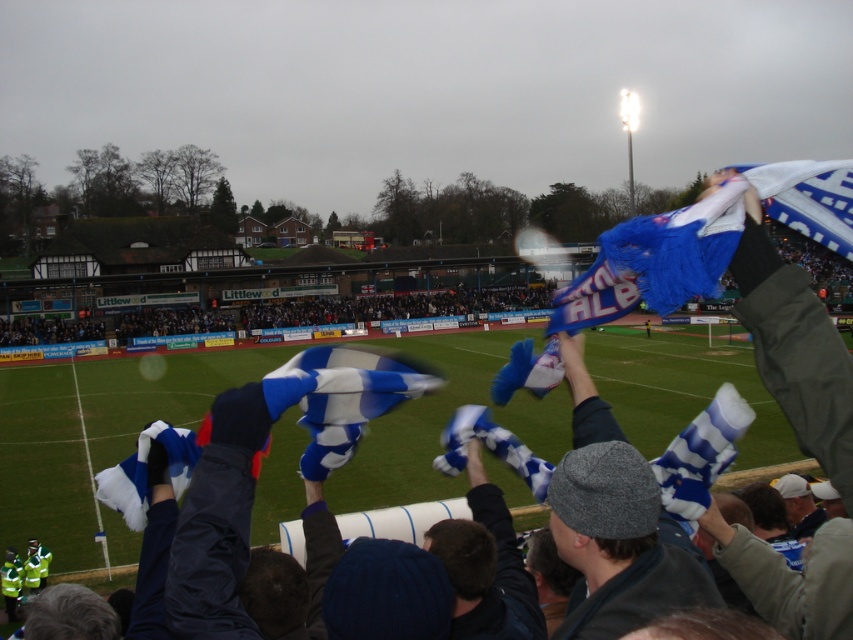
Based on the photo, does blue and white striped scarf at upper right have a smaller size compared to blue and white fabric at upper center?

Yes.

Is blue and white striped scarf at upper right bigger than blue and white fabric at upper center?

No.

At what (x,y) coordinates should I click in order to perform the action: click on blue and white striped scarf at upper right. Please return your answer as a coordinate pair (x, y). The image size is (853, 640). Looking at the image, I should click on (701, 456).